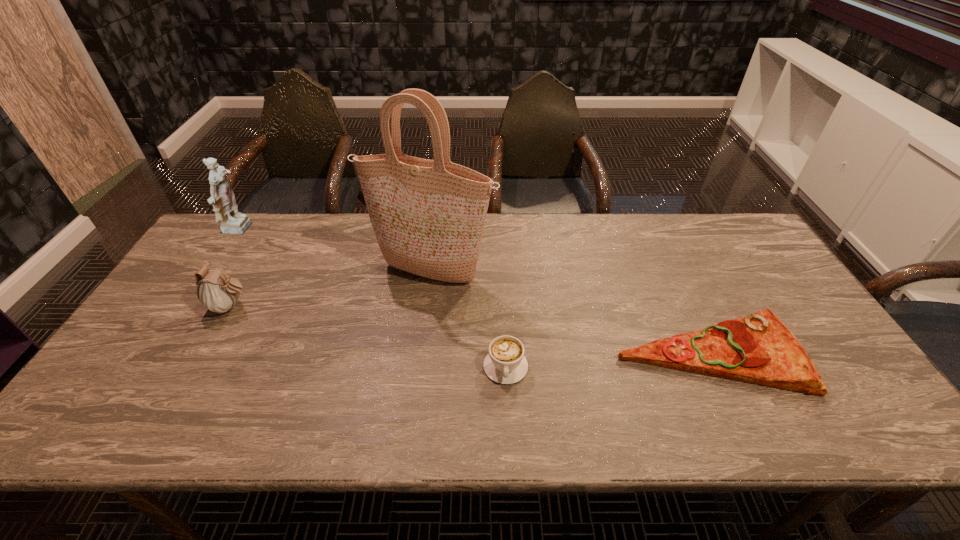
Find the location of a particular element. The width and height of the screenshot is (960, 540). shopping bag is located at coordinates (428, 216).

Identify the location of the tallest object. This screenshot has width=960, height=540. (428, 216).

Identify the location of figurine. The height and width of the screenshot is (540, 960). (222, 198).

Image resolution: width=960 pixels, height=540 pixels. I want to click on the farthest object, so click(222, 198).

You are a GUI agent. You are given a task and a screenshot of the screen. Output one action in this format:
    pyautogui.click(x=<x>, y=<y>)
    Task: Click on the third tallest object
    The height and width of the screenshot is (540, 960).
    Given the screenshot: What is the action you would take?
    pyautogui.click(x=217, y=292)

You are a GUI agent. You are given a task and a screenshot of the screen. Output one action in this format:
    pyautogui.click(x=<x>, y=<y>)
    Task: Click on the pouch
    
    Given the screenshot: What is the action you would take?
    click(217, 292)

In order to click on cappuccino in this screenshot , I will do `click(505, 363)`.

Identify the location of the rightmost object. The width and height of the screenshot is (960, 540). (759, 349).

The image size is (960, 540). In order to click on pizza in this screenshot , I will do `click(759, 349)`.

Locate an element on the screen. This screenshot has height=540, width=960. blank area located 0.060m on the left of the shopping bag is located at coordinates (347, 273).